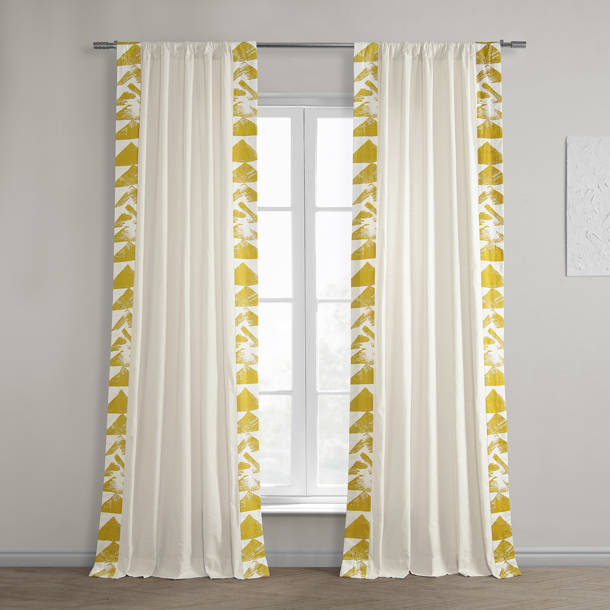
This screenshot has height=610, width=610. I want to click on window pane, so click(x=271, y=173), click(x=336, y=183), click(x=332, y=254), click(x=337, y=339), click(x=335, y=432), click(x=271, y=434), click(x=277, y=343), click(x=274, y=255).